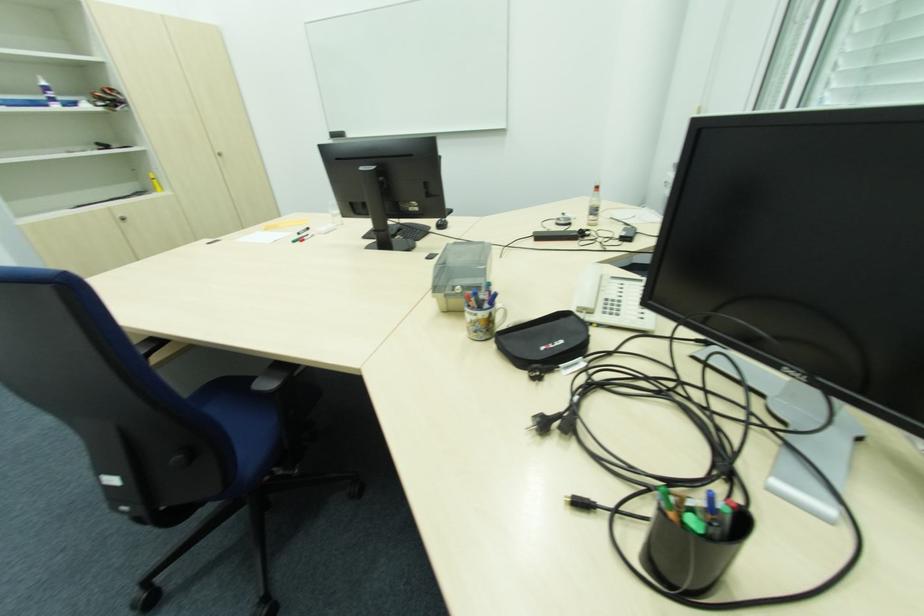
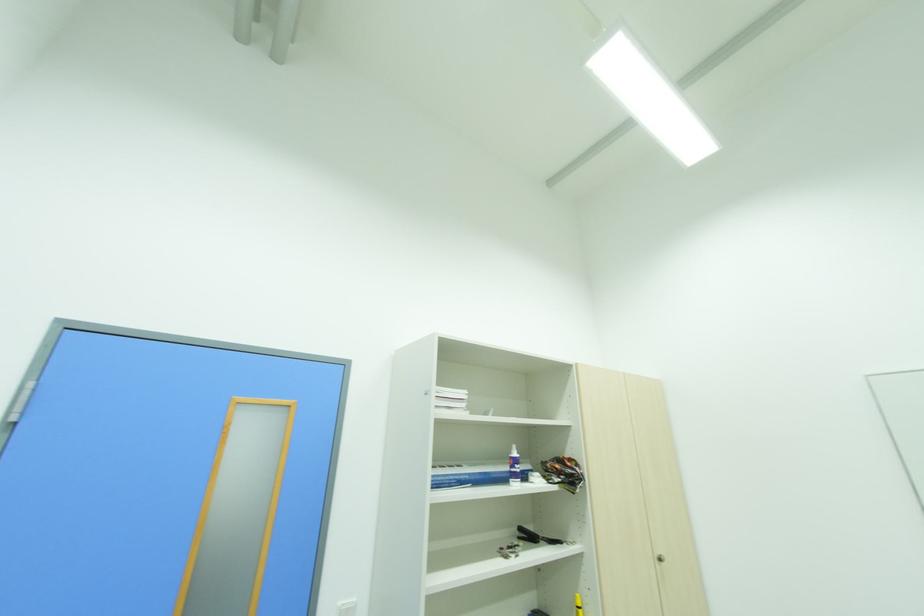
Find the pixel in the second image that matches point (108, 148) in the first image.

(536, 539)